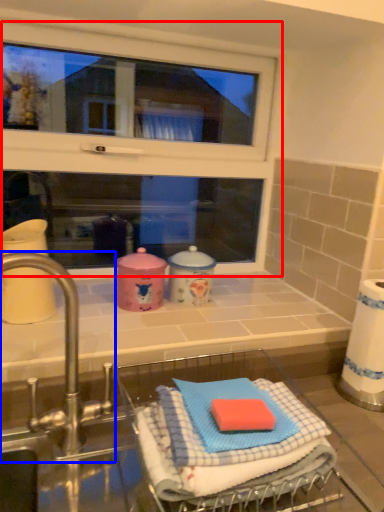
Question: Which of the following is the closest to the observer, window (highlighted by a red box) or tap (highlighted by a blue box)?

Choices:
 (A) window
 (B) tap

Answer: (B)